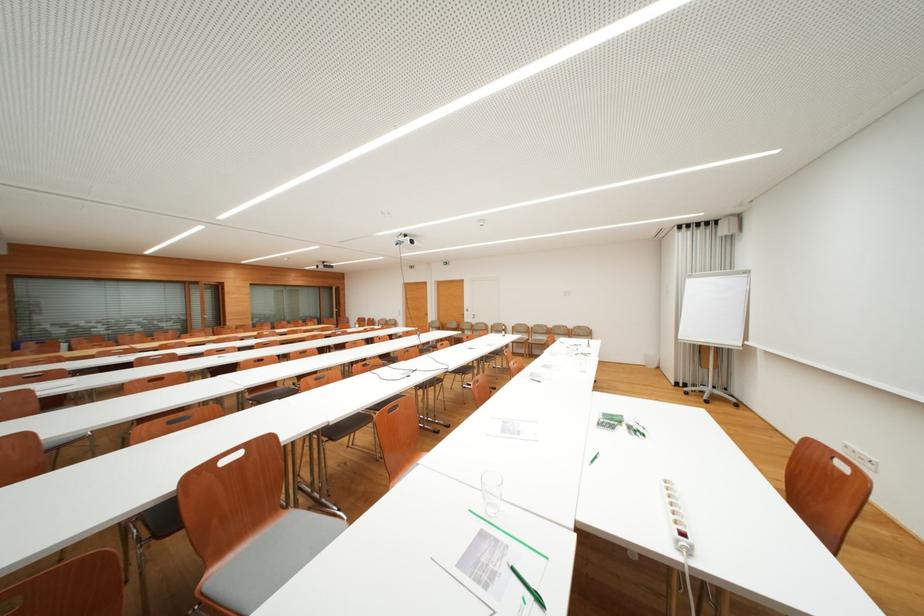
The height and width of the screenshot is (616, 924). Describe the element at coordinates (274, 554) in the screenshot. I see `a gray chair sitting surface` at that location.